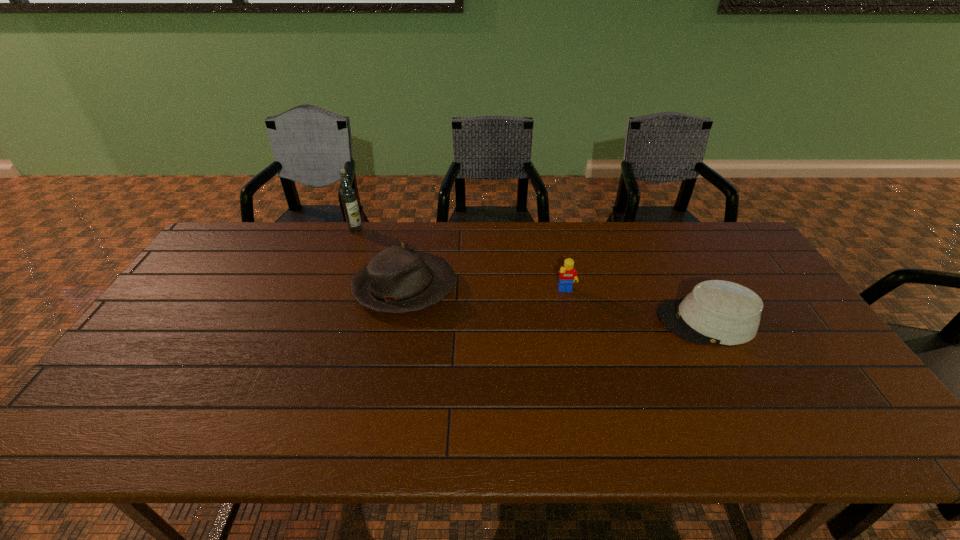
The width and height of the screenshot is (960, 540). Identify the location of vacant space located on the front-facing side of the shortest object. (x=559, y=321).

You are a GUI agent. You are given a task and a screenshot of the screen. Output one action in this format:
    pyautogui.click(x=<x>, y=<y>)
    Task: Click on the vacant region located 0.380m on the front-facing side of the shortest object
    The width and height of the screenshot is (960, 540).
    Given the screenshot: What is the action you would take?
    pyautogui.click(x=522, y=321)

This screenshot has width=960, height=540. Identify the location of blank space located on the front-facing side of the shortest object. (547, 321).

The width and height of the screenshot is (960, 540). I want to click on vodka positioned at the far edge, so click(348, 195).

Where is `hat that is at the far edge`? hat that is at the far edge is located at coordinates (396, 280).

At what (x,y) coordinates should I click in order to perform the action: click on object at the right edge. Please return your answer as a coordinate pair (x, y). Looking at the image, I should click on (719, 312).

Locate an element on the screen. The image size is (960, 540). free space at the far edge of the desktop is located at coordinates (396, 228).

The width and height of the screenshot is (960, 540). In the image, there is a desktop. What are the coordinates of `vacant space at the near edge` in the screenshot? It's located at (357, 443).

Image resolution: width=960 pixels, height=540 pixels. Identify the location of vacant space at the right edge of the desktop. (837, 380).

The height and width of the screenshot is (540, 960). In order to click on vacant area at the near left corner of the desktop in this screenshot , I will do `click(126, 438)`.